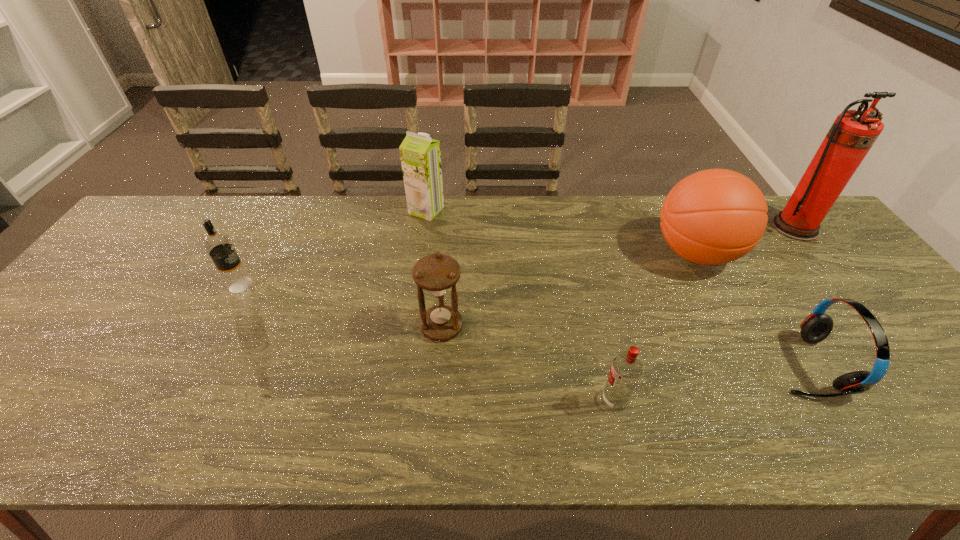
Locate an element on the screen. The image size is (960, 540). vacant space at the right edge of the desktop is located at coordinates (892, 357).

In order to click on unoccupied position between the basketball and the headset in this screenshot , I will do `click(751, 309)`.

I want to click on blank region between the shorter vodka and the hourglass, so (528, 363).

This screenshot has width=960, height=540. In order to click on blank region between the soya milk and the left vodka in this screenshot , I will do `click(333, 248)`.

The width and height of the screenshot is (960, 540). What are the coordinates of `free spot between the hourglass and the shorter vodka` in the screenshot? It's located at (528, 363).

Identify the location of vacant area between the basketball and the soya milk. (561, 232).

The height and width of the screenshot is (540, 960). Find the location of `vacant space that's between the right vodka and the headset`. vacant space that's between the right vodka and the headset is located at coordinates (710, 383).

You are a GUI agent. You are given a task and a screenshot of the screen. Output one action in this format:
    pyautogui.click(x=<x>, y=<y>)
    Task: Click on the free space between the soya milk and the fourth object from left to right
    This screenshot has height=540, width=960.
    Given the screenshot: What is the action you would take?
    click(x=520, y=305)

Locate an element on the screen. The width and height of the screenshot is (960, 540). free area in between the soya milk and the leftmost object is located at coordinates (333, 248).

Locate an element on the screen. free space between the basketball and the hourglass is located at coordinates (568, 290).